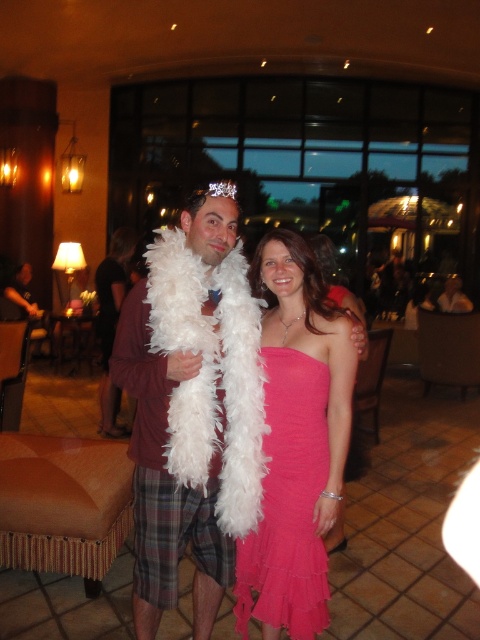
Question: Which of these objects is positioned farthest from the clear crystal tiara at upper center?

Choices:
 (A) pink satin dress at center
 (B) white feather boa at center

Answer: (A)

Question: Does pink satin dress at center have a lesser width compared to clear crystal tiara at upper center?

Choices:
 (A) no
 (B) yes

Answer: (A)

Question: Does white feather boa at center have a larger size compared to pink satin dress at center?

Choices:
 (A) no
 (B) yes

Answer: (B)

Question: Considering the real-world distances, which object is farthest from the pink satin dress at center?

Choices:
 (A) clear crystal tiara at upper center
 (B) white feather boa at center

Answer: (A)

Question: Is white feather boa at center positioned at the back of clear crystal tiara at upper center?

Choices:
 (A) no
 (B) yes

Answer: (A)

Question: Which object is farther from the camera taking this photo?

Choices:
 (A) white feather boa at center
 (B) pink satin dress at center

Answer: (B)